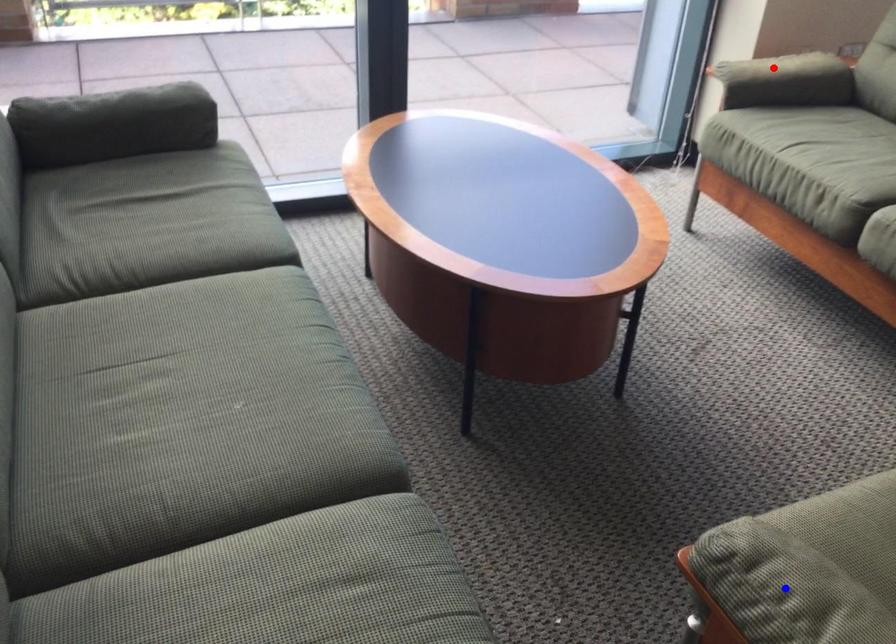
Question: Which of the two points in the image is closer to the camera?

Choices:
 (A) Blue point is closer.
 (B) Red point is closer.

Answer: (A)